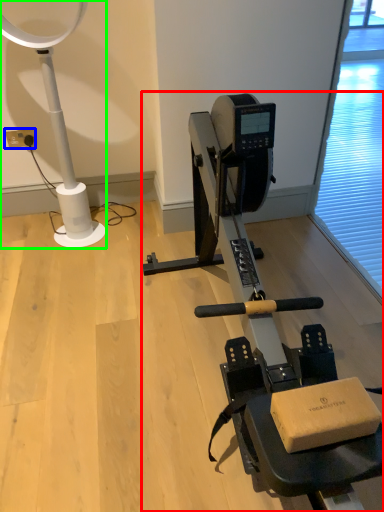
Question: Considering the real-world distances, which object is closest to stationary bicycle (highlighted by a red box)? electric outlet (highlighted by a blue box) or lamp (highlighted by a green box).

Choices:
 (A) electric outlet
 (B) lamp

Answer: (B)